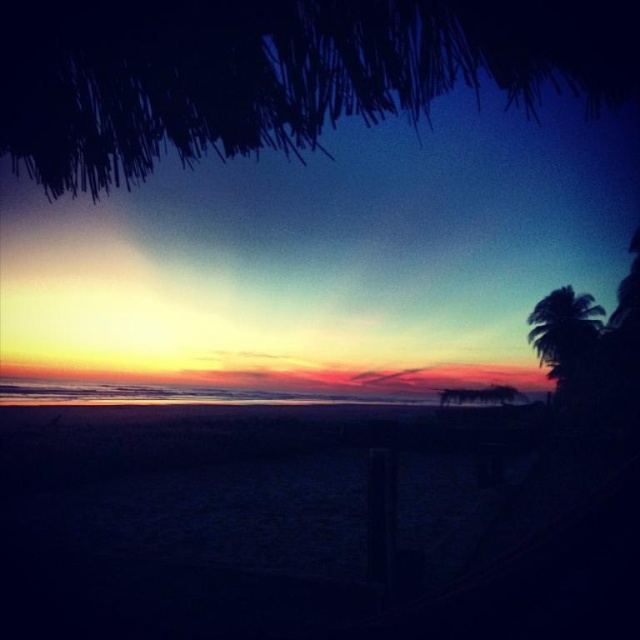
You are a photographer trying to capture the sunset. You have a camera that can only focus on objects taller than 2 meters. You see the dark sand at lower center and the silhouette leafy palm at right in your viewfinder. Will either of these objects be in focus?

The silhouette leafy palm at right is taller than the dark sand at lower center, so it will be in focus. The dark sand at lower center is shorter than 2 meters and won

You are standing on the beach and want to take a photo of the sunset. You have a camera that can only capture objects wider than the silhouette leafy palm at right. Will the dark sand at lower center fit in your shot?

The dark sand at lower center is wider than the silhouette leafy palm at right, so it will fit in the camera shot.